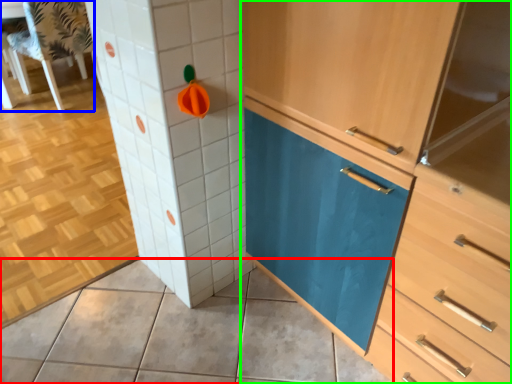
Question: Which object is positioned closest to ceramic tile (highlighted by a red box)? Select from chair (highlighted by a blue box) and cabinetry (highlighted by a green box).

Choices:
 (A) chair
 (B) cabinetry

Answer: (B)